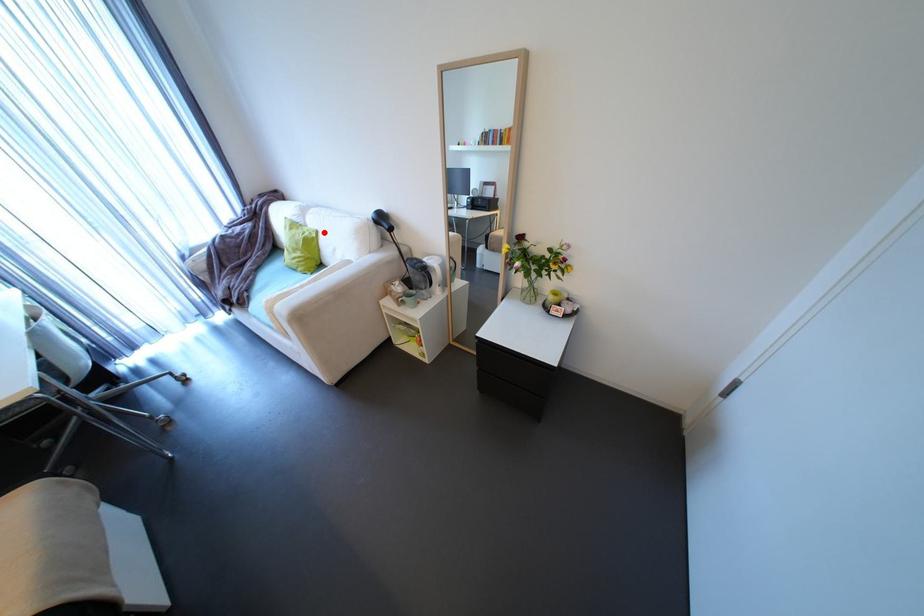
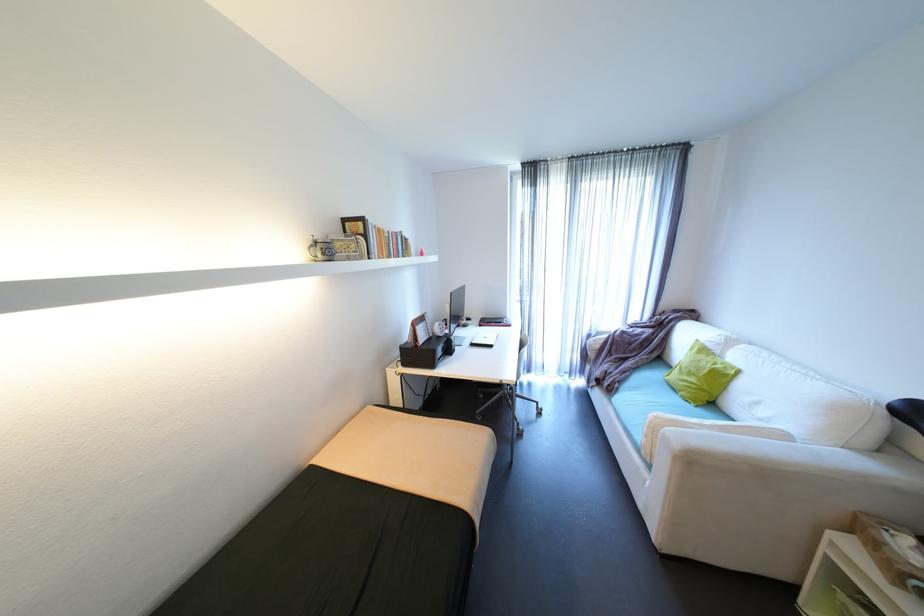
In the second image, find the point that corresponds to the highlighted location in the first image.

(747, 371)